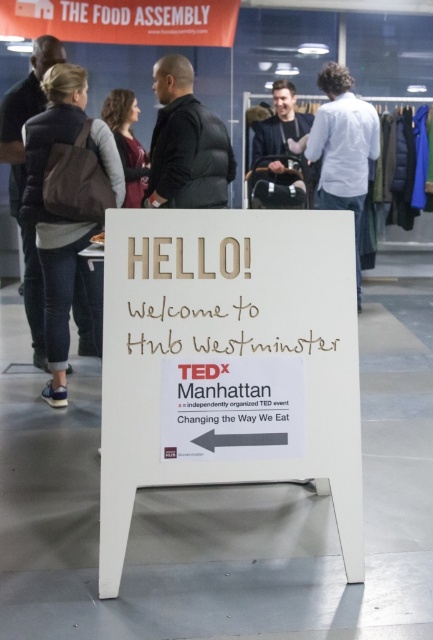
Does black puffer jacket at center have a lesser height compared to matte gray sweater at upper left?

Correct, black puffer jacket at center is not as tall as matte gray sweater at upper left.

Does black puffer jacket at center have a smaller size compared to matte gray sweater at upper left?

No.

Who is more distant from viewer, [175,65] or [119,145]?

The point [119,145] is more distant.

You are a GUI agent. You are given a task and a screenshot of the screen. Output one action in this format:
    pyautogui.click(x=<x>, y=<y>)
    Task: Click on the black puffer jacket at center
    Image resolution: width=433 pixels, height=640 pixels.
    Given the screenshot: What is the action you would take?
    pyautogui.click(x=186, y=144)

How far apart are white cardboard sign at center and black puffer jacket at center?

The distance of white cardboard sign at center from black puffer jacket at center is 5.84 feet.

Does white cardboard sign at center lie in front of black puffer jacket at center?

That is True.

Is point (349, 252) farther from viewer compared to point (186, 118)?

No, it is in front of (186, 118).

Find the location of a particular element. white cardboard sign at center is located at coordinates [x=229, y=362].

Can you confirm if denim jacket at left is taller than black puffer jacket at center?

Yes, denim jacket at left is taller than black puffer jacket at center.

Is point (64, 68) less distant than point (213, 164)?

Yes, it is.

Does point (65, 113) come closer to viewer compared to point (184, 115)?

Yes, point (65, 113) is in front of point (184, 115).

At what (x,y) coordinates should I click in order to perform the action: click on denim jacket at left. Please return your answer as a coordinate pair (x, y). This screenshot has width=433, height=640. Looking at the image, I should click on (67, 205).